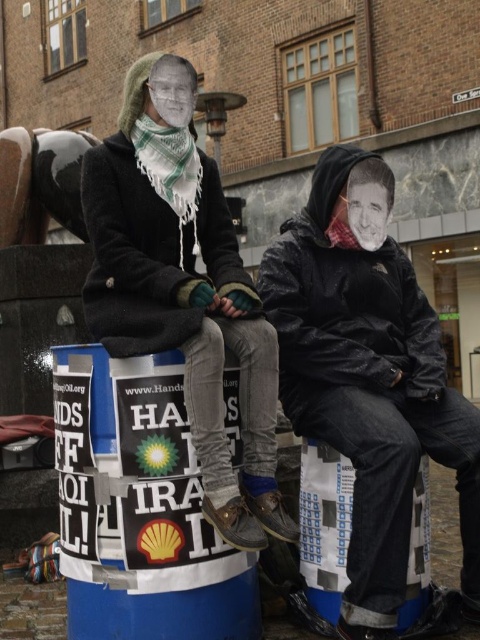
From the picture: Is wet black jacket at center below matte black coat at upper left?

Correct, wet black jacket at center is located below matte black coat at upper left.

Who is more distant from viewer, (331, 262) or (188, 330)?

The point (331, 262) is behind.

This screenshot has width=480, height=640. Describe the element at coordinates (369, 378) in the screenshot. I see `wet black jacket at center` at that location.

Locate an element on the screen. The image size is (480, 640). wet black jacket at center is located at coordinates (369, 378).